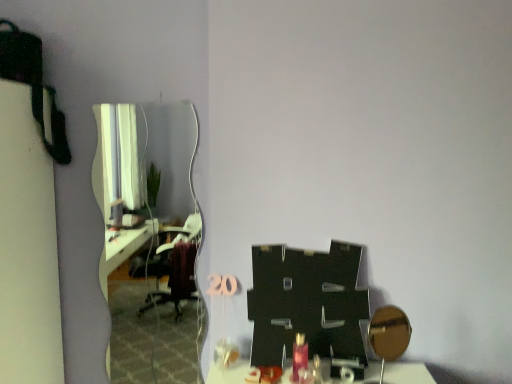
I want to click on white glossy mirror at upper left, so click(143, 175).

The width and height of the screenshot is (512, 384). Describe the element at coordinates (143, 175) in the screenshot. I see `white glossy mirror at upper left` at that location.

In order to click on white glossy mirror at upper left in this screenshot , I will do `click(143, 175)`.